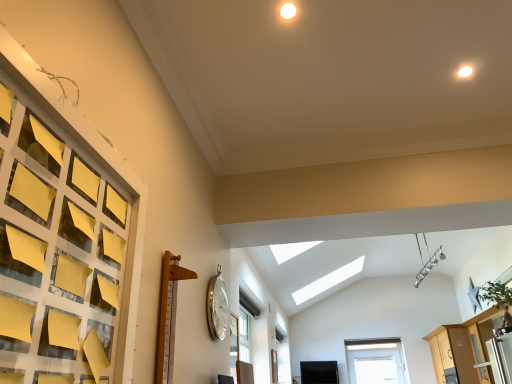
Question: Is the position of silver metallic clock at upper center more distant than that of wooden dresser at lower right?

Choices:
 (A) no
 (B) yes

Answer: (A)

Question: Considering the relative positions of silver metallic clock at upper center and wooden dresser at lower right in the image provided, is silver metallic clock at upper center to the right of wooden dresser at lower right from the viewer's perspective?

Choices:
 (A) no
 (B) yes

Answer: (A)

Question: Is silver metallic clock at upper center closer to camera compared to wooden dresser at lower right?

Choices:
 (A) no
 (B) yes

Answer: (B)

Question: Does silver metallic clock at upper center appear on the left side of wooden dresser at lower right?

Choices:
 (A) yes
 (B) no

Answer: (A)

Question: Is wooden dresser at lower right surrounded by silver metallic clock at upper center?

Choices:
 (A) no
 (B) yes

Answer: (A)

Question: From the image's perspective, is silver metallic clock at upper center under wooden dresser at lower right?

Choices:
 (A) no
 (B) yes

Answer: (A)

Question: Is wooden dresser at lower right far away from silver metallic clock at upper center?

Choices:
 (A) no
 (B) yes

Answer: (B)

Question: Does wooden dresser at lower right have a lesser width compared to silver metallic clock at upper center?

Choices:
 (A) yes
 (B) no

Answer: (B)

Question: Does wooden dresser at lower right have a larger size compared to silver metallic clock at upper center?

Choices:
 (A) yes
 (B) no

Answer: (A)

Question: Would you say wooden dresser at lower right is outside silver metallic clock at upper center?

Choices:
 (A) no
 (B) yes

Answer: (B)

Question: Considering the relative sizes of wooden dresser at lower right and silver metallic clock at upper center in the image provided, is wooden dresser at lower right taller than silver metallic clock at upper center?

Choices:
 (A) yes
 (B) no

Answer: (A)

Question: From a real-world perspective, is wooden dresser at lower right physically below silver metallic clock at upper center?

Choices:
 (A) yes
 (B) no

Answer: (A)

Question: Is wooden dresser at lower right taller or shorter than silver metallic clock at upper center?

Choices:
 (A) short
 (B) tall

Answer: (B)